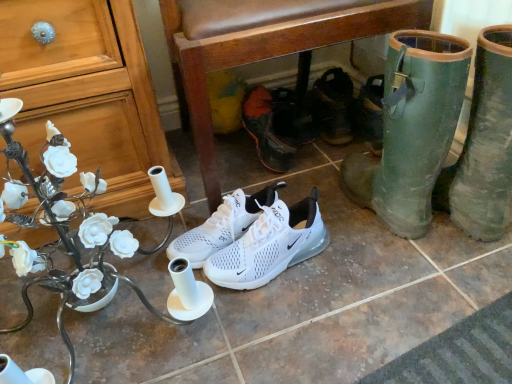
Image resolution: width=512 pixels, height=384 pixels. What are the coordinates of `vacant space underneath matte white desk at center (from a real-world perspective)` in the screenshot? It's located at (104, 311).